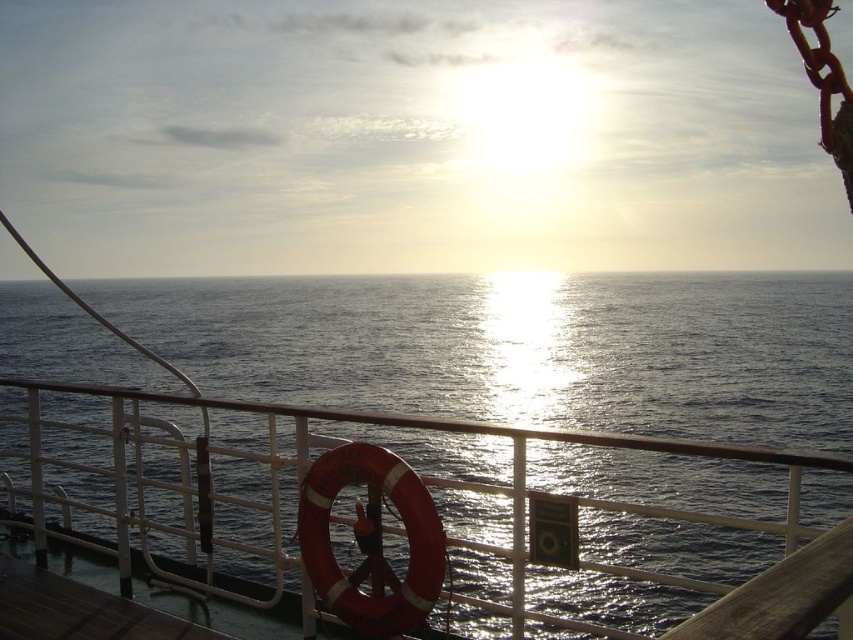
You are standing on the ship and want to compare the sizes of the glistening water at center and the brown wooden deck at lower left. Which one appears wider from your viewpoint?

The glistening water at center appears wider than the brown wooden deck at lower left because its width is larger according to the description.

Consider the image. You are standing on the ship and want to take a photo of the sunset. You notice the glistening water at center and the brown wooden deck at lower left. Which object should you focus on if you want to capture the largest subject in the frame?

The glistening water at center is bigger than the brown wooden deck at lower left, so you should focus on the glistening water at center to capture the largest subject in the frame.